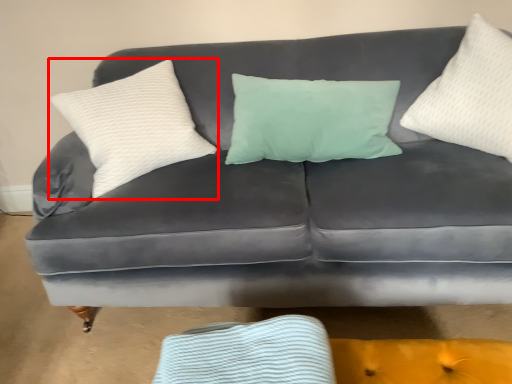
Question: From the image's perspective, what is the correct spatial relationship of pillow (annotated by the red box) in relation to pillow?

Choices:
 (A) above
 (B) below

Answer: (B)